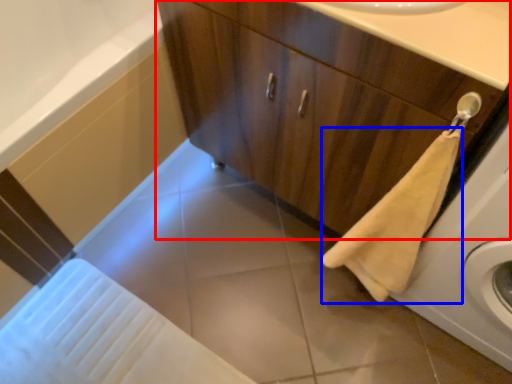
Question: Which point is closer to the camera, bathroom cabinet (highlighted by a red box) or bath towel (highlighted by a blue box)?

Choices:
 (A) bathroom cabinet
 (B) bath towel

Answer: (B)